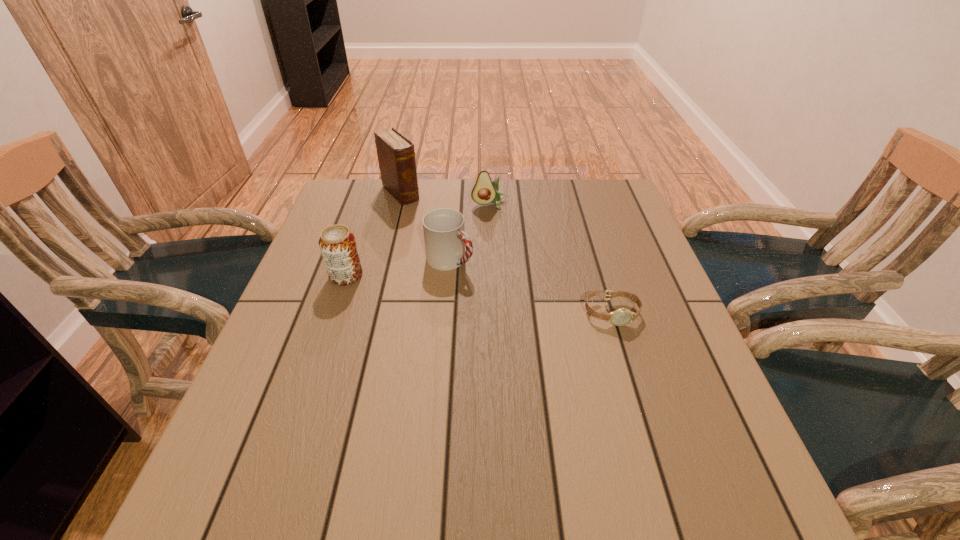
I want to click on vacant space located 0.350m on the spine side of the diary, so click(475, 266).

This screenshot has height=540, width=960. Identify the location of vacant position located on the side of the cup where the handle is located. (491, 285).

Identify the location of vacant space situated 0.230m on the side of the cup where the handle is located. (540, 316).

At what (x,y) coordinates should I click in order to perform the action: click on vacant space located 0.240m on the side of the cup where the handle is located. Please return your answer as a coordinate pair (x, y). Looking at the image, I should click on (544, 319).

Identify the location of vacant space positioned on the seed side of the avocado. The width and height of the screenshot is (960, 540). (494, 222).

At what (x,y) coordinates should I click in order to perform the action: click on free space located 0.240m on the seed side of the avocado. Please return your answer as a coordinate pair (x, y). Looking at the image, I should click on (503, 262).

Locate an element on the screen. The image size is (960, 540). free location located 0.350m on the seed side of the avocado is located at coordinates (509, 292).

This screenshot has height=540, width=960. In order to click on diary positioned at the far edge in this screenshot , I will do `click(396, 156)`.

This screenshot has width=960, height=540. Identify the location of avocado positioned at the far edge. (484, 191).

Identify the location of beer can located at the left edge. This screenshot has height=540, width=960. (337, 243).